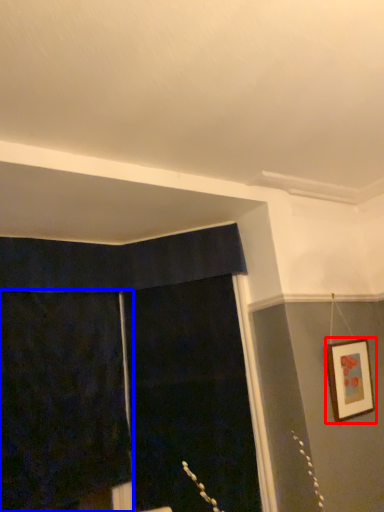
Question: Which point is further to the camera, picture frame (highlighted by a red box) or curtain (highlighted by a blue box)?

Choices:
 (A) picture frame
 (B) curtain

Answer: (A)